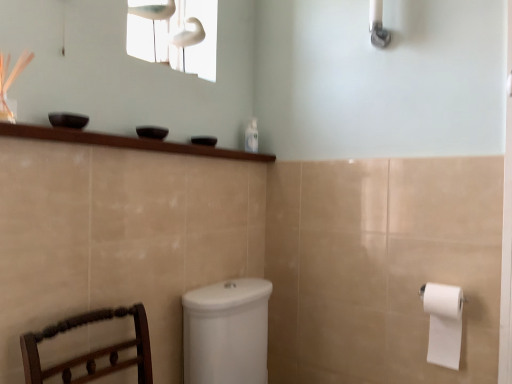
Question: Looking at the image, does clear plastic bottle at upper center seem bigger or smaller compared to white glossy window screen at upper center?

Choices:
 (A) big
 (B) small

Answer: (B)

Question: Considering the positions of clear plastic bottle at upper center and white glossy window screen at upper center in the image, is clear plastic bottle at upper center taller or shorter than white glossy window screen at upper center?

Choices:
 (A) tall
 (B) short

Answer: (B)

Question: Estimate the real-world distances between objects in this image. Which object is farther from the white glossy shower head at upper right?

Choices:
 (A) white matte toilet paper at right
 (B) clear plastic bottle at upper center
 (C) white glossy window screen at upper center

Answer: (A)

Question: Which object is positioned closest to the white glossy shower head at upper right?

Choices:
 (A) white glossy window screen at upper center
 (B) clear plastic bottle at upper center
 (C) white matte toilet paper at right

Answer: (B)